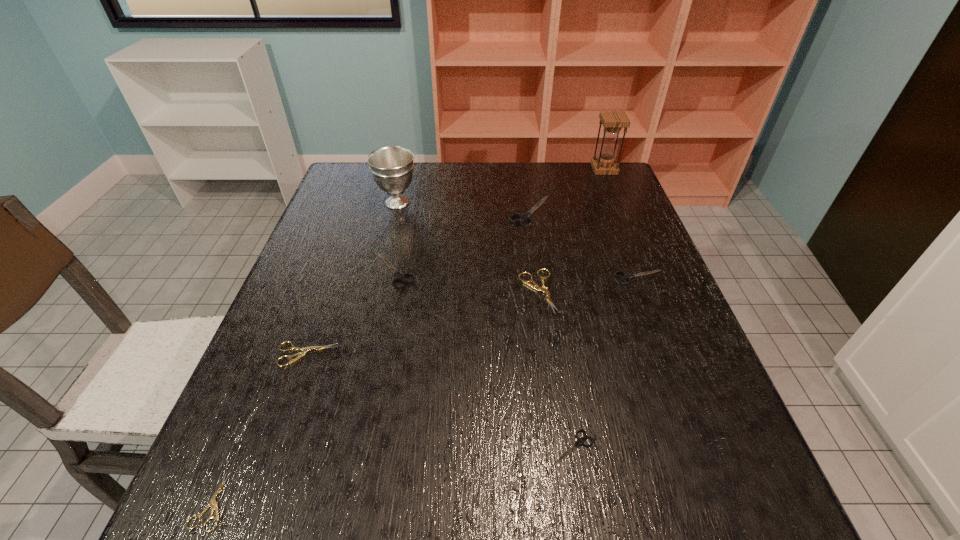
Identify the location of free region at the near right corner of the desktop. The image size is (960, 540). (715, 535).

You are a GUI agent. You are given a task and a screenshot of the screen. Output one action in this format:
    pyautogui.click(x=<x>, y=<y>)
    Task: Click on the free space that is in between the rightmost beige shears and the hourglass
    
    Given the screenshot: What is the action you would take?
    pyautogui.click(x=571, y=230)

At what (x,y) coordinates should I click in order to perform the action: click on vacant area between the tallest object and the rightmost shears. Please return your answer as a coordinate pair (x, y). Looking at the image, I should click on (622, 223).

You are a GUI agent. You are given a task and a screenshot of the screen. Output one action in this format:
    pyautogui.click(x=<x>, y=<y>)
    Task: Click on the free area in between the nearest beige shears and the farthest object
    The width and height of the screenshot is (960, 540).
    Given the screenshot: What is the action you would take?
    pyautogui.click(x=408, y=335)

The width and height of the screenshot is (960, 540). I want to click on unoccupied position between the leftmost black shears and the tallest object, so click(500, 220).

At what (x,y) coordinates should I click in order to perform the action: click on empty space between the nearest object and the rightmost black shears. Please return your answer as a coordinate pair (x, y). This screenshot has height=540, width=960. Looking at the image, I should click on (425, 389).

Image resolution: width=960 pixels, height=540 pixels. I want to click on unoccupied area between the nearest beige shears and the second biggest black shears, so click(304, 386).

I want to click on free area in between the third biggest black shears and the sixth farthest shears, so click(606, 362).

What are the coordinates of `free space between the biggest black shears and the biggest beige shears` in the screenshot? It's located at (534, 251).

Identify the location of free point between the eighth shortest object and the smallest black shears. This screenshot has width=960, height=540. 485,325.